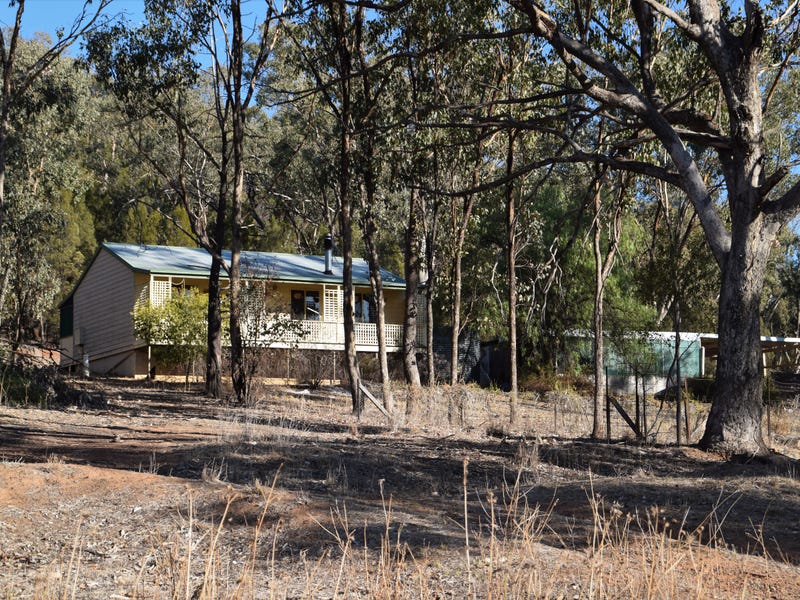
At what (x,y) coordinates should I click in order to perform the action: click on door. Please return your answer as a coordinate pair (x, y). This screenshot has height=600, width=800. Looking at the image, I should click on (309, 305).